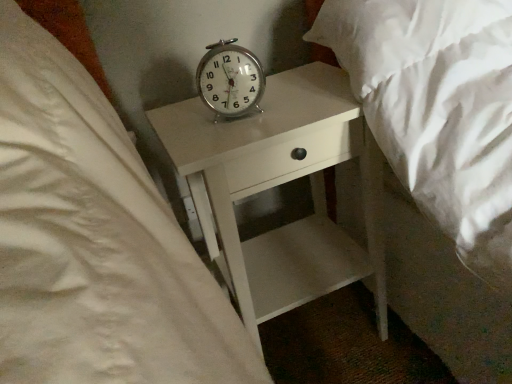
This screenshot has height=384, width=512. Describe the element at coordinates (230, 80) in the screenshot. I see `metallic silver alarm clock at center` at that location.

Measure the distance between point (244,70) and camera.

The depth of point (244,70) is 80.40 centimeters.

Where is `metallic silver alarm clock at center`? metallic silver alarm clock at center is located at coordinates (230, 80).

Describe the element at coordinates (277, 185) in the screenshot. I see `white glossy nightstand at center` at that location.

I want to click on white glossy nightstand at center, so click(277, 185).

You are a GUI agent. You are given a task and a screenshot of the screen. Output one action in this format:
    pyautogui.click(x=<x>, y=<y>)
    Task: Click on the metallic silver alarm clock at center
    Image resolution: width=512 pixels, height=384 pixels.
    Given the screenshot: What is the action you would take?
    pyautogui.click(x=230, y=80)

Does white glossy nightstand at center appear on the right side of metallic silver alarm clock at center?

Yes.

Considering the positions of objects white glossy nightstand at center and metallic silver alarm clock at center in the image provided, who is in front, white glossy nightstand at center or metallic silver alarm clock at center?

Positioned in front is white glossy nightstand at center.

Considering the positions of point (349, 252) and point (253, 95), is point (349, 252) closer or farther from the camera than point (253, 95)?

Point (349, 252).

From the image's perspective, which is below, white glossy nightstand at center or metallic silver alarm clock at center?

From the image's view, white glossy nightstand at center is below.

From a real-world perspective, is white glossy nightstand at center over metallic silver alarm clock at center?

No.

Can you confirm if white glossy nightstand at center is wider than metallic silver alarm clock at center?

Yes.

Considering the sizes of objects white glossy nightstand at center and metallic silver alarm clock at center in the image provided, who is taller, white glossy nightstand at center or metallic silver alarm clock at center?

With more height is white glossy nightstand at center.

Is white glossy nightstand at center smaller than metallic silver alarm clock at center?

No.

Do you think white glossy nightstand at center is within metallic silver alarm clock at center, or outside of it?

The correct answer is: outside.

Is white glossy nightstand at center next to metallic silver alarm clock at center and touching it?

No, white glossy nightstand at center is not in contact with metallic silver alarm clock at center.

Is white glossy nightstand at center positioned with its back to metallic silver alarm clock at center?

No, white glossy nightstand at center's orientation is not away from metallic silver alarm clock at center.

This screenshot has height=384, width=512. In order to click on nightstand in front of the metallic silver alarm clock at center in this screenshot , I will do `click(277, 185)`.

Considering the positions of objects metallic silver alarm clock at center and white glossy nightstand at center in the image provided, who is more to the left, metallic silver alarm clock at center or white glossy nightstand at center?

metallic silver alarm clock at center.

Between metallic silver alarm clock at center and white glossy nightstand at center, which one is positioned behind?

metallic silver alarm clock at center is further away from the camera.

Which is in front, point (230, 47) or point (316, 116)?

The point (316, 116) is closer to the camera.

From the picture: From the image's perspective, is metallic silver alarm clock at center beneath white glossy nightstand at center?

Actually, metallic silver alarm clock at center appears above white glossy nightstand at center in the image.

Based on the photo, from a real-world perspective, which is physically below, metallic silver alarm clock at center or white glossy nightstand at center?

white glossy nightstand at center, from a real-world perspective.

In terms of width, does metallic silver alarm clock at center look wider or thinner when compared to white glossy nightstand at center?

Considering their sizes, metallic silver alarm clock at center looks slimmer than white glossy nightstand at center.

Between metallic silver alarm clock at center and white glossy nightstand at center, which one has less height?

metallic silver alarm clock at center is shorter.

Is metallic silver alarm clock at center bigger or smaller than white glossy nightstand at center?

Clearly, metallic silver alarm clock at center is smaller in size than white glossy nightstand at center.

Is metallic silver alarm clock at center inside the boundaries of white glossy nightstand at center, or outside?

metallic silver alarm clock at center is not enclosed by white glossy nightstand at center.

Is metallic silver alarm clock at center positioned far away from white glossy nightstand at center?

No, metallic silver alarm clock at center is not far from white glossy nightstand at center.

Could you tell me if metallic silver alarm clock at center is turned towards white glossy nightstand at center?

No, metallic silver alarm clock at center is not aimed at white glossy nightstand at center.

What's the angular difference between metallic silver alarm clock at center and white glossy nightstand at center's facing directions?

The angular difference between metallic silver alarm clock at center and white glossy nightstand at center is 12 degrees.

Locate an element on the screen. nightstand on the right of the metallic silver alarm clock at center is located at coordinates (277, 185).

Find the location of `alarm clock behind the white glossy nightstand at center`. alarm clock behind the white glossy nightstand at center is located at coordinates (230, 80).

Identify the location of nightstand beneath the metallic silver alarm clock at center (from a real-world perspective). The height and width of the screenshot is (384, 512). point(277,185).